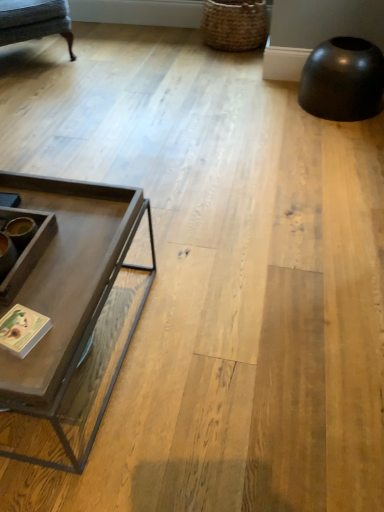
Find the location of a particular element. This screenshot has width=384, height=512. vacant space underneath textured gray fabric swivel chair at upper left (from a real-world perspective) is located at coordinates (36, 56).